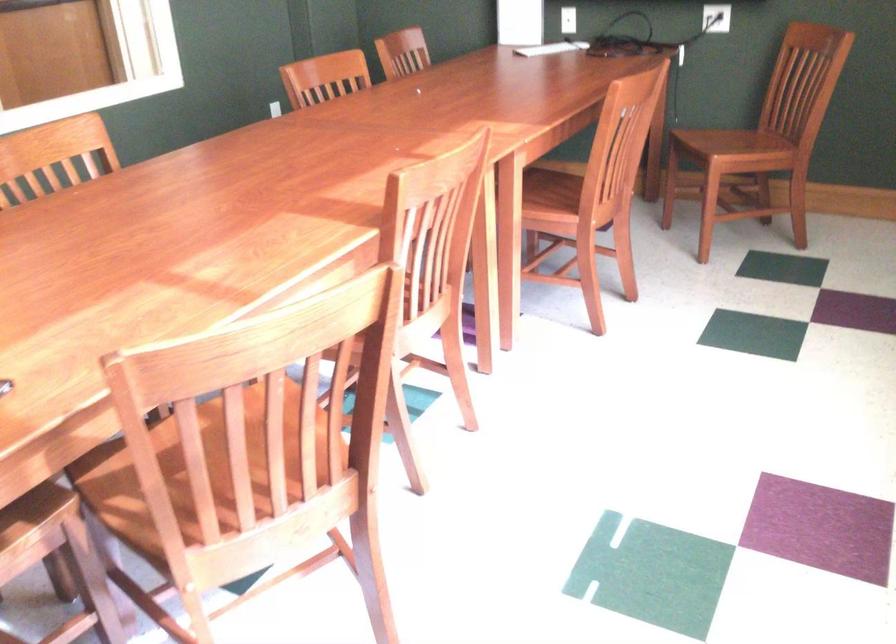
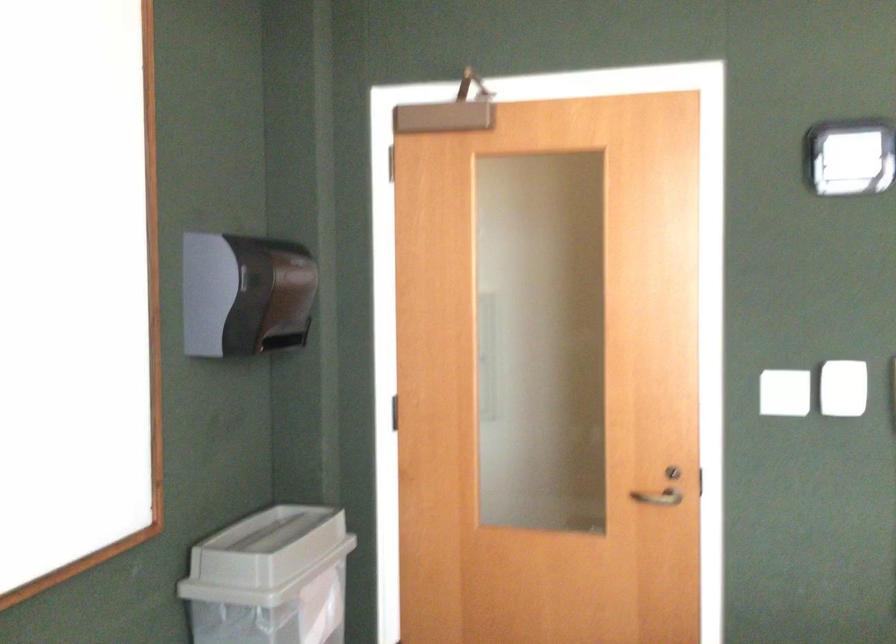
Question: The first image is from the beginning of the video and the second image is from the end. How did the camera likely rotate when shooting the video?

Choices:
 (A) Left
 (B) Right
 (C) Up
 (D) Down

Answer: (A)